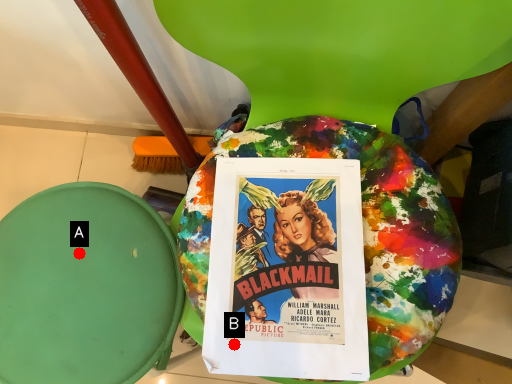
Question: Two points are circled on the image, labeled by A and B beside each circle. Which point is farther from the camera taking this photo?

Choices:
 (A) A is further
 (B) B is further

Answer: (A)